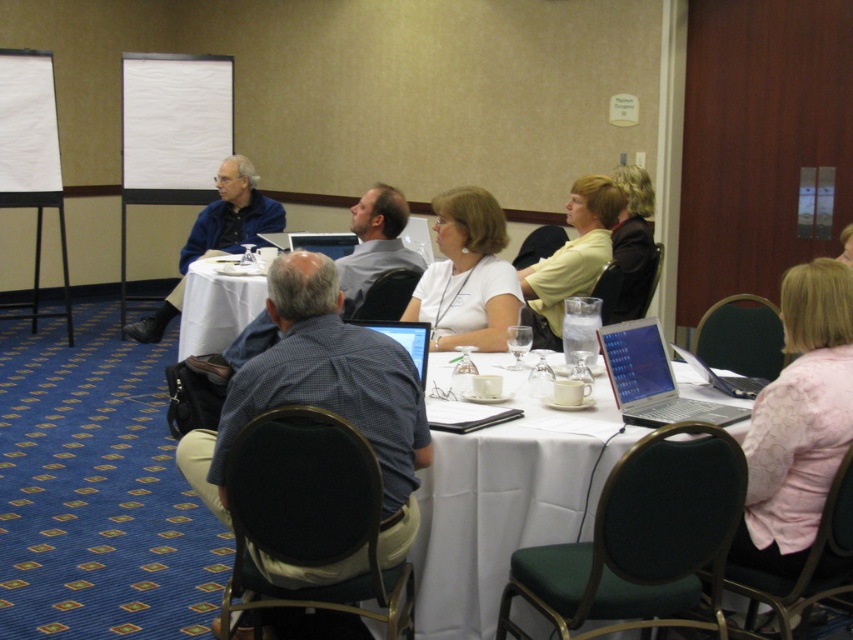
You are standing at the point labeled point (572, 221). You need to walk to the door located at the opposite end of the room. The room is 8.4 meters long. Can you reach the door without crossing the middle of the room?

The distance between you and the door is 8.4 meters. Since you are starting at point (572, 221), which is 4.20 meters away from the middle, you can reach the door without crossing the middle by walking along the perimeter of the room.

You are standing in the conference room and want to determine the relative positions of two points marked in the image. Which point is closer to you? The points are labeled as point (x=570, y=196) and point (x=235, y=248).

Point (x=570, y=196) is closer to you than point (x=235, y=248).